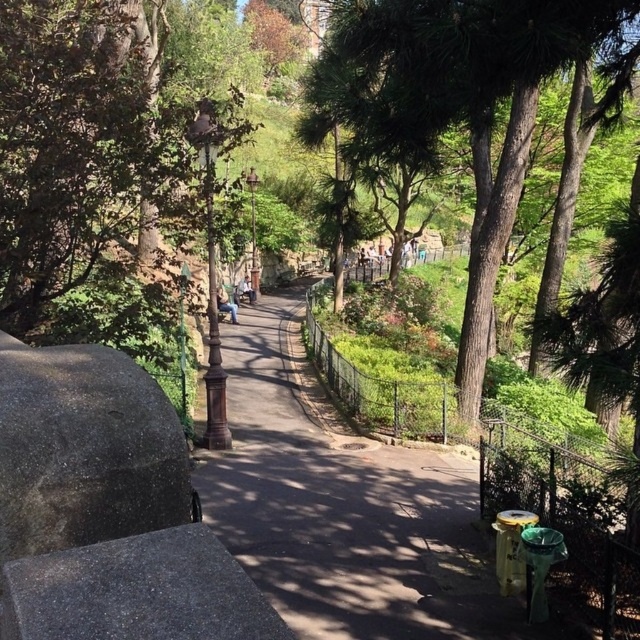
Question: Can you confirm if green leafy tree at upper left is positioned below denim jacket at center?

Choices:
 (A) no
 (B) yes

Answer: (A)

Question: Does green leafy tree at upper left have a greater width compared to denim jacket at center?

Choices:
 (A) no
 (B) yes

Answer: (B)

Question: Which object appears closest to the camera in this image?

Choices:
 (A) green leafy tree at upper left
 (B) light blue jeans at center
 (C) green textured tree at center
 (D) denim jacket at center

Answer: (C)

Question: Which point is farther to the camera?

Choices:
 (A) denim jacket at center
 (B) green leafy tree at upper left
 (C) green textured tree at center
 (D) light blue jeans at center

Answer: (D)

Question: Which object appears farthest from the camera in this image?

Choices:
 (A) light blue jeans at center
 (B) green leafy tree at upper left
 (C) denim jacket at center

Answer: (A)

Question: Is green leafy tree at upper left bigger than green textured tree at center?

Choices:
 (A) yes
 (B) no

Answer: (B)